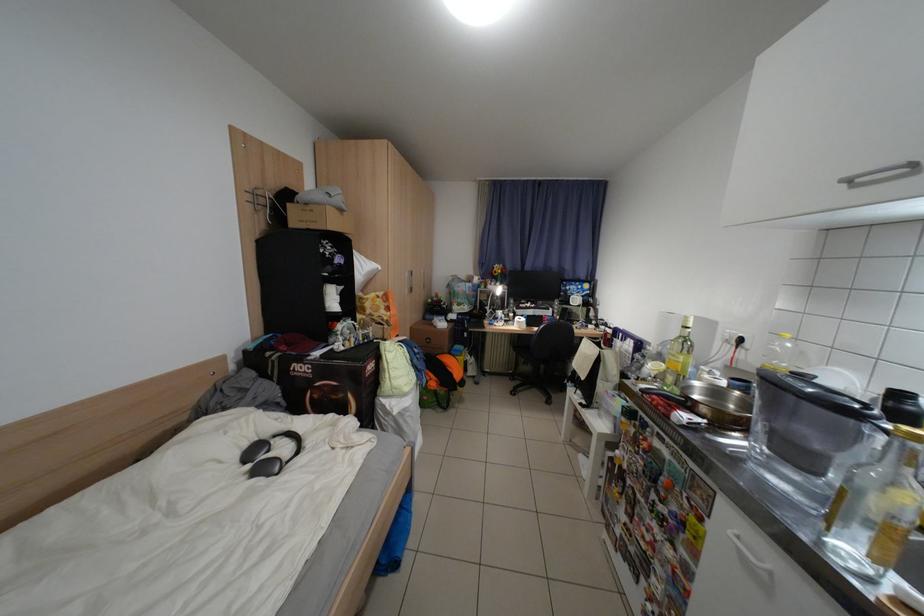
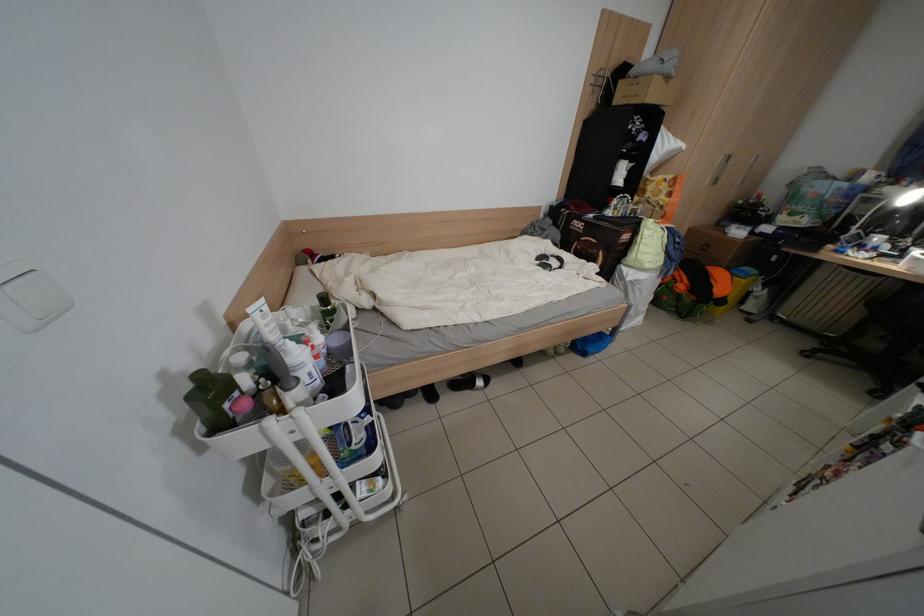
Find the pixel in the second image that matches the point at 300,207 in the first image.

(631, 83)